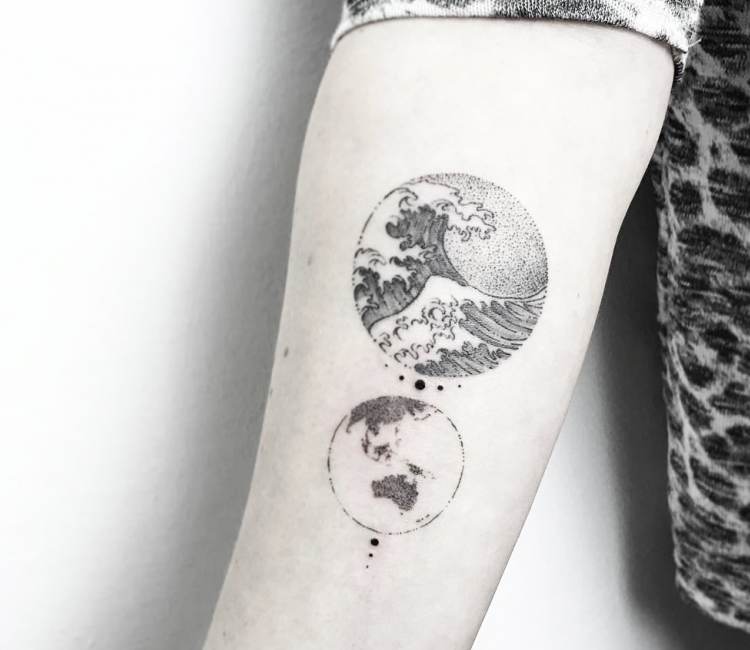
Identify the location of wall. Image resolution: width=750 pixels, height=650 pixels. (255, 182).